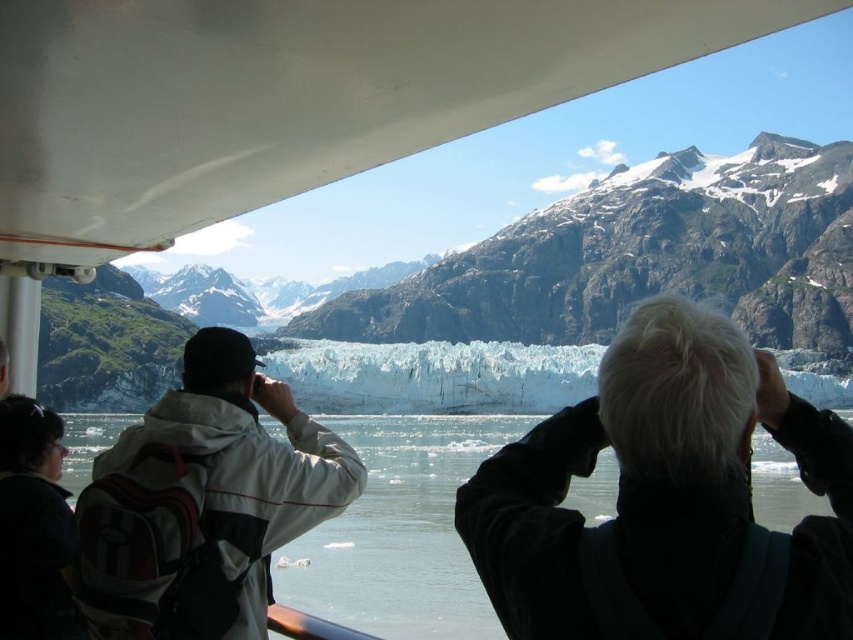
You are a photographer on the boat and want to capture a clear photo of the glacier. You notice two white objects in your viewfinder. Which object, the white matte hair at upper right or the white matte jacket at center, is bigger in the photo?

The white matte hair at upper right is larger in size compared to the white matte jacket at center, so it will appear bigger in the photo.

Based on the photo, you are on a boat looking at a glacier and mountains. There are three people in front of you, each holding binoculars. You see a point marked at coordinates [401,531]. What is located at that point?

The point at coordinates [401,531] marks clear water at center.

You are on a boat and want to know how far the point at coordinates (177, 474) is from your position. Can you determine the distance?

The point at coordinates (177, 474) is 106.42 meters away from the camera, so the distance from your position on the boat to that point is 106.42 meters.